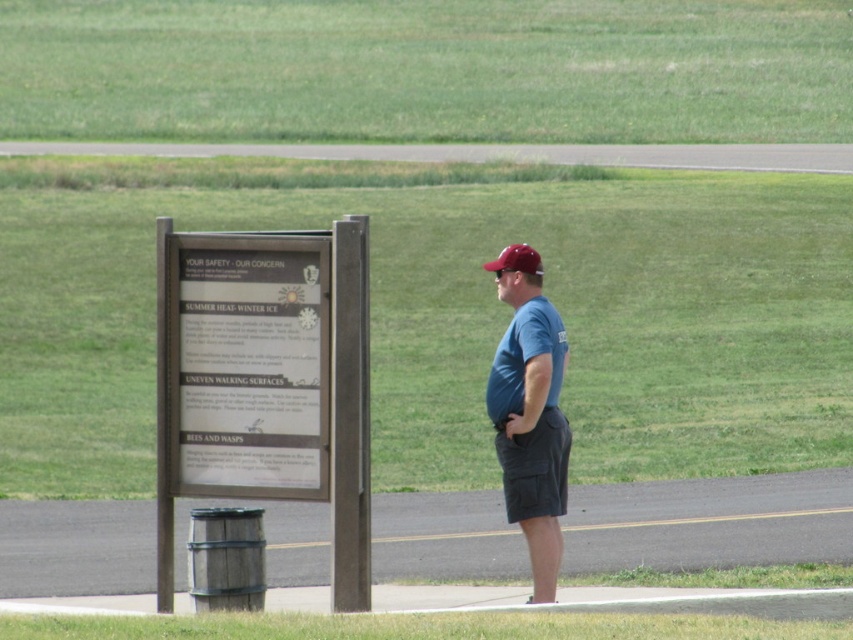
Between point (508, 522) and point (549, 474), which one is positioned behind?

Point (508, 522)

Who is positioned more to the right, blue cotton shirt at center or dark gray cotton shorts at right?

Positioned to the right is blue cotton shirt at center.

The height and width of the screenshot is (640, 853). I want to click on blue cotton shirt at center, so click(x=531, y=413).

Is brushed metal sign at left wider than maroon matte baseball cap at center?

Correct, the width of brushed metal sign at left exceeds that of maroon matte baseball cap at center.

Is point (196, 371) positioned before point (534, 266)?

Yes, it is in front of point (534, 266).

Where is `brushed metal sign at left`? The width and height of the screenshot is (853, 640). brushed metal sign at left is located at coordinates (265, 381).

Is blue cotton shirt at center to the left of maroon matte baseball cap at center from the viewer's perspective?

No, blue cotton shirt at center is not to the left of maroon matte baseball cap at center.

Is blue cotton shirt at center below maroon matte baseball cap at center?

Indeed, blue cotton shirt at center is positioned under maroon matte baseball cap at center.

Does point (540, 284) come closer to viewer compared to point (508, 253)?

Yes, point (540, 284) is closer to viewer.

This screenshot has width=853, height=640. I want to click on blue cotton shirt at center, so click(x=531, y=413).